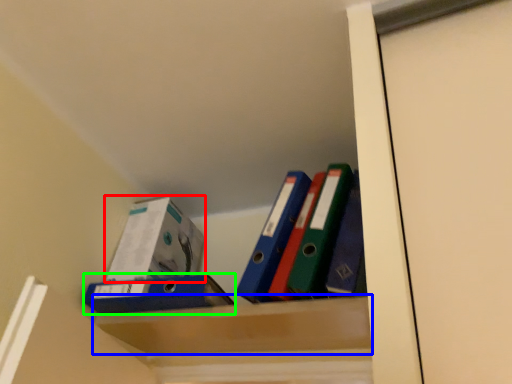
Question: Based on their relative distances, which object is nearer to box (highlighted by a red box)? Choose from cabinet (highlighted by a blue box) and paperback book (highlighted by a green box).

Choices:
 (A) cabinet
 (B) paperback book

Answer: (B)